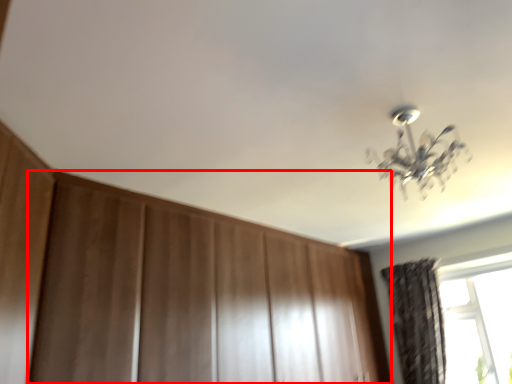
Question: From the image, what is the correct spatial relationship of dresser (annotated by the red box) in relation to curtain?

Choices:
 (A) left
 (B) right

Answer: (A)